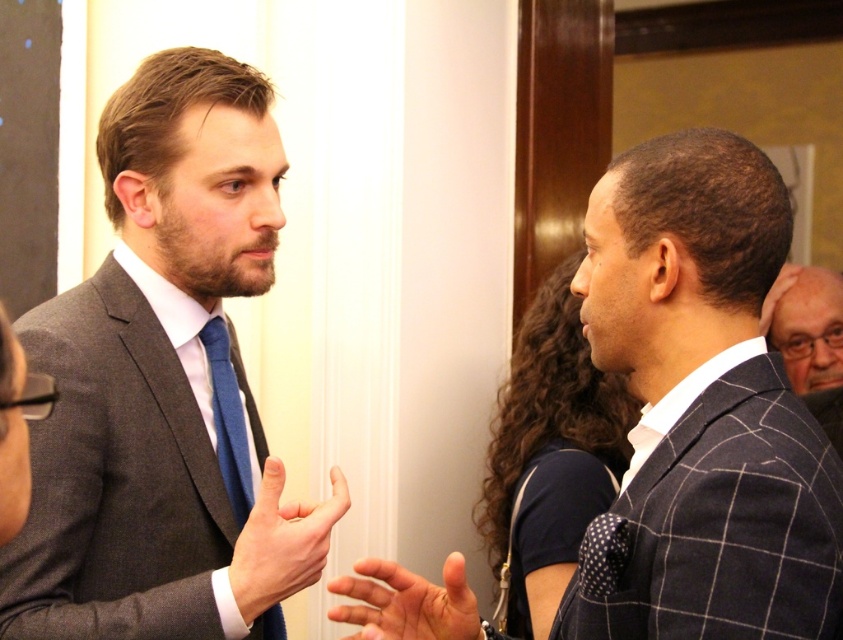
Is dark blue checkered suit at right taller than blue silk tie at center?

Indeed, dark blue checkered suit at right has a greater height compared to blue silk tie at center.

Between dark blue checkered suit at right and blue silk tie at center, which one has less height?

blue silk tie at center is shorter.

Is point (627, 230) closer to camera compared to point (235, 445)?

Yes.

Locate an element on the screen. The height and width of the screenshot is (640, 843). dark blue checkered suit at right is located at coordinates [701, 410].

Which is in front, point (809, 275) or point (235, 499)?

Point (235, 499) is in front.

Who is taller, matte black suit at right or blue silk tie at center?

blue silk tie at center is taller.

Locate an element on the screen. The height and width of the screenshot is (640, 843). matte black suit at right is located at coordinates (809, 339).

The width and height of the screenshot is (843, 640). Find the location of `matte black suit at right`. matte black suit at right is located at coordinates (809, 339).

Can you confirm if matte gray suit at center is smaller than blue silk tie at center?

Actually, matte gray suit at center might be larger than blue silk tie at center.

Who is lower down, matte gray suit at center or blue silk tie at center?

blue silk tie at center is lower down.

Does point (46, 428) come in front of point (224, 492)?

Yes.

Locate an element on the screen. Image resolution: width=843 pixels, height=640 pixels. matte gray suit at center is located at coordinates (165, 387).